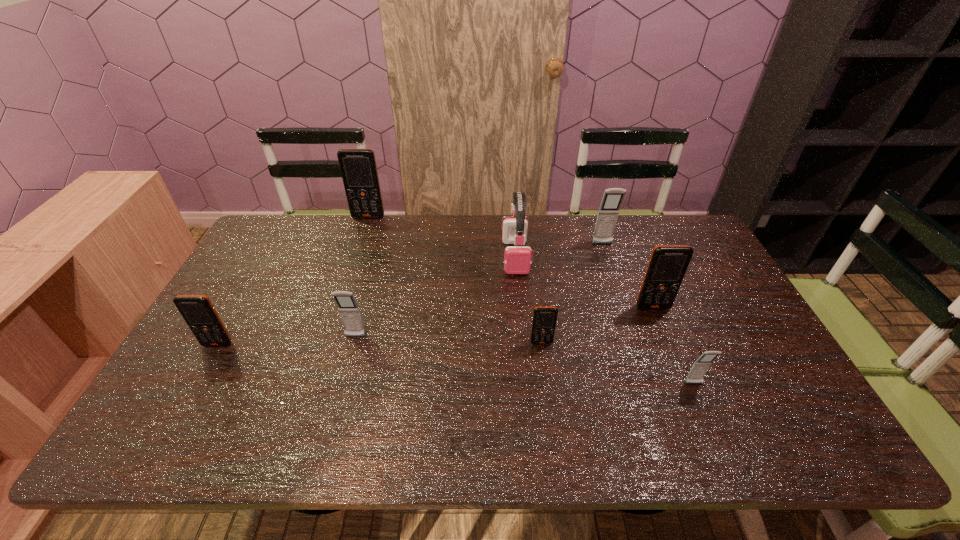
Identify the location of free space at the far right corner of the desktop. (673, 239).

Find the location of a particular element. The height and width of the screenshot is (540, 960). vacant space at the near right corner of the desktop is located at coordinates (788, 446).

Locate an element on the screen. empty space that is in between the farthest object and the nearest gray cellular telephone is located at coordinates (531, 300).

The image size is (960, 540). In order to click on free spot between the second orange cellular telephone from right to left and the biggest orange cellular telephone in this screenshot , I will do `click(455, 280)`.

This screenshot has height=540, width=960. Find the location of `vacant region between the leftmost cellular telephone and the biggest orange cellular telephone`. vacant region between the leftmost cellular telephone and the biggest orange cellular telephone is located at coordinates (293, 281).

Locate an element on the screen. This screenshot has height=540, width=960. free space between the earphone and the nearest cellular telephone is located at coordinates (605, 320).

Where is `empty location between the nearest object and the leftmost orange cellular telephone`? Image resolution: width=960 pixels, height=540 pixels. empty location between the nearest object and the leftmost orange cellular telephone is located at coordinates (456, 364).

The height and width of the screenshot is (540, 960). Find the location of `free spot between the second smallest gray cellular telephone and the fourth cellular telephone from right to left`. free spot between the second smallest gray cellular telephone and the fourth cellular telephone from right to left is located at coordinates (448, 340).

This screenshot has width=960, height=540. What are the coordinates of `free spot between the nearest cellular telephone and the second smallest orange cellular telephone` in the screenshot? It's located at (456, 364).

You are a GUI agent. You are given a task and a screenshot of the screen. Output one action in this format:
    pyautogui.click(x=<x>, y=<y>)
    Task: Click on the vacant area that lies between the second gray cellular telephone from right to left and the second nearest gray cellular telephone
    The width and height of the screenshot is (960, 540).
    Given the screenshot: What is the action you would take?
    pyautogui.click(x=479, y=291)